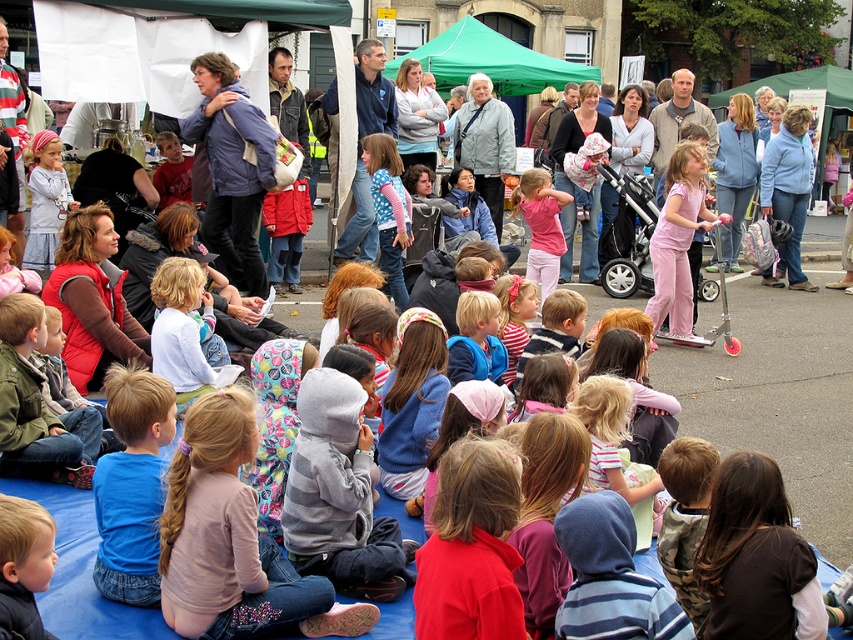
You are standing at the entrance of the street where the lively outdoor gathering is happening. You want to locate the green fabric canopy at upper center. Which direction should you look to find it?

The green fabric canopy at upper center is located at point (491, 60), so you should look towards the upper center direction to find it.

You are organizing an outdoor event and need to decide which fabric to prioritize for shade. Given the green fabric canopy at upper center and the light blue fabric at center, which one provides more coverage based on their sizes?

The green fabric canopy at upper center is larger in size than the light blue fabric at center, so it provides more coverage for shade.